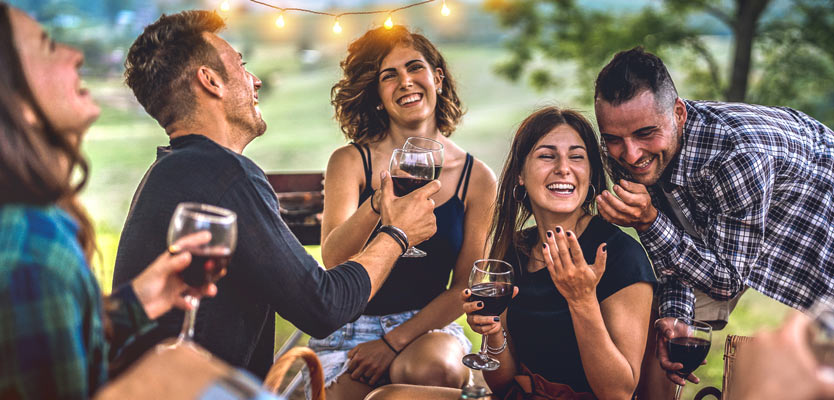
Image resolution: width=834 pixels, height=400 pixels. Find the location of `light bulb`. light bulb is located at coordinates (238, 7), (288, 20), (340, 33), (390, 24), (450, 7).